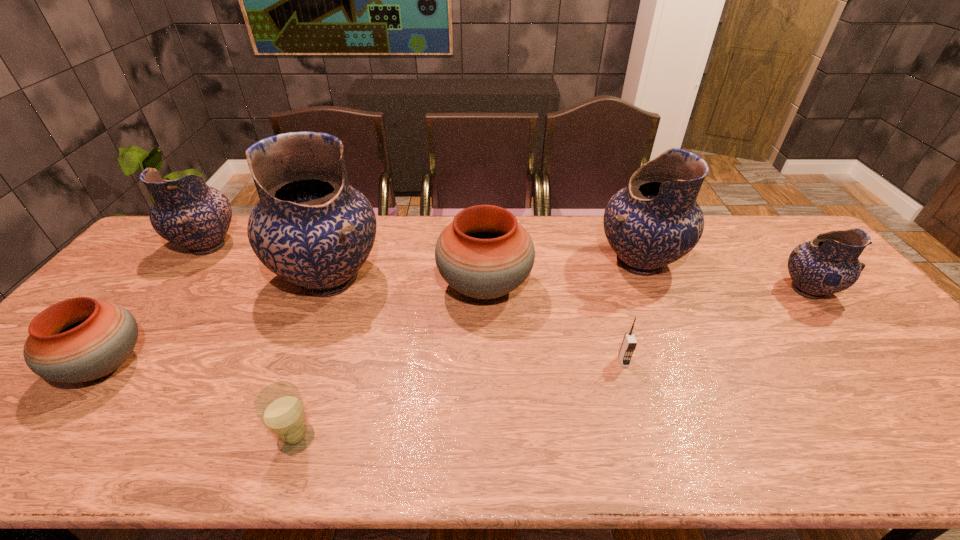
Where is `free space between the smaller red pottery and the third blue pottery from left to right`? Image resolution: width=960 pixels, height=540 pixels. free space between the smaller red pottery and the third blue pottery from left to right is located at coordinates pyautogui.click(x=372, y=314).

Locate an element on the screen. The width and height of the screenshot is (960, 540). empty location between the tallest object and the right red pottery is located at coordinates (407, 282).

The height and width of the screenshot is (540, 960). Find the location of `vacant area that lies between the smallest blue pottery and the blue glass`. vacant area that lies between the smallest blue pottery and the blue glass is located at coordinates 552,364.

In order to click on free area in between the third pottery from right to left and the nearest pottery in this screenshot , I will do `click(295, 326)`.

Identify the location of free space between the cellular telephone and the sixth tallest object. (365, 363).

Identify the location of empty location between the cellular telephone and the rightmost object. (716, 326).

You are a GUI agent. You are given a task and a screenshot of the screen. Output one action in this format:
    pyautogui.click(x=<x>, y=<y>)
    Task: Click on the vacant space that's between the third shortest object and the second smallest blue pottery
    The height and width of the screenshot is (540, 960).
    Given the screenshot: What is the action you would take?
    pyautogui.click(x=156, y=306)

Where is `vacant area that lies between the fourth pottery from right to left and the rightmost pottery`? This screenshot has width=960, height=540. vacant area that lies between the fourth pottery from right to left and the rightmost pottery is located at coordinates (568, 285).

This screenshot has width=960, height=540. What are the coordinates of `object that stands as the fifth closest to the smaller red pottery` in the screenshot? It's located at (629, 343).

Select which object is the sixth closest to the seventh shortest object. Please provide its 2D coordinates. Your answer should be formatted as a tuple, i.e. [(x, y)], where the tuple contains the x and y coordinates of a point satisfying the conditions above.

[(187, 212)]